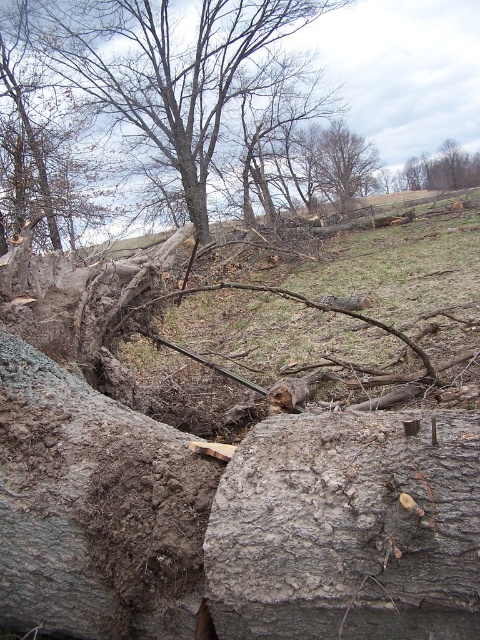
Question: Can you confirm if gray rough log at center is thinner than smooth bark tree at upper right?

Choices:
 (A) no
 (B) yes

Answer: (B)

Question: Can you confirm if gray rough log at center is wider than brown rough tree at upper center?

Choices:
 (A) yes
 (B) no

Answer: (B)

Question: Which object appears closest to the camera in this image?

Choices:
 (A) smooth bark tree at upper right
 (B) smooth bark tree at upper center

Answer: (B)

Question: Which object is the closest to the smooth bark tree at upper center?

Choices:
 (A) gray rough boulder at center
 (B) brown bark tree at upper left
 (C) brown rough tree at upper center
 (D) smooth bark tree at upper right

Answer: (B)

Question: Which of the following is the closest to the observer?

Choices:
 (A) brown rough tree at upper center
 (B) smooth bark tree at upper right

Answer: (A)

Question: Is gray rough boulder at center bigger than smooth bark tree at upper center?

Choices:
 (A) yes
 (B) no

Answer: (A)